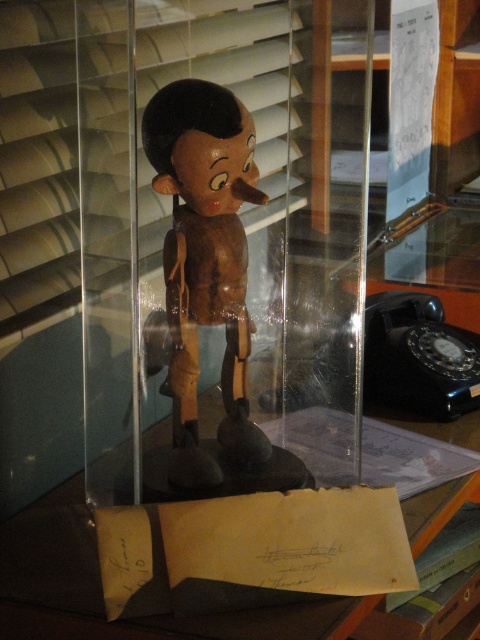
Between point (194, 476) and point (71, 490), which one is positioned in front?

Point (194, 476) is in front.

Between wooden figurine at center and transparent plastic table at center, which one appears on the right side from the viewer's perspective?

From the viewer's perspective, transparent plastic table at center appears more on the right side.

Identify the location of wooden figurine at center. (205, 262).